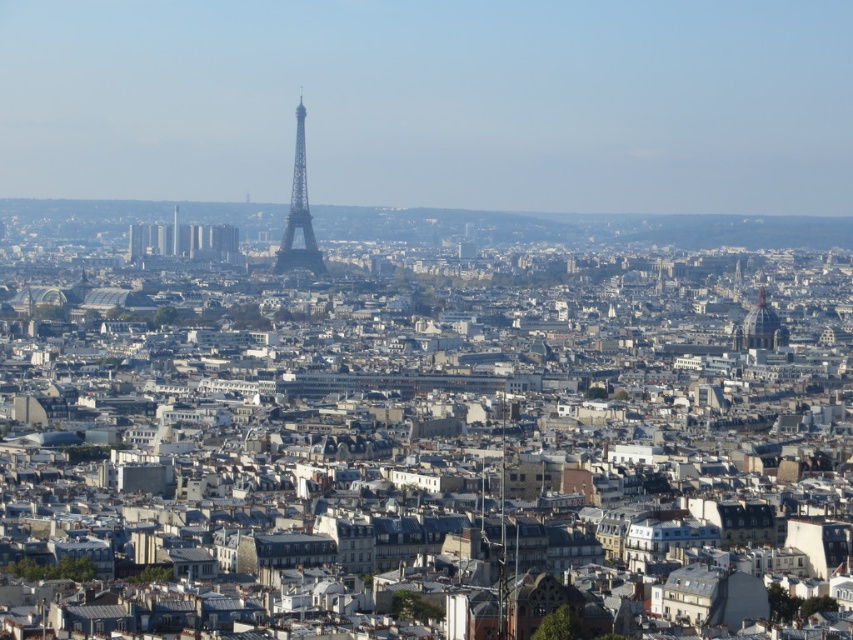
Looking at this image, you are standing at the point with coordinates 0.2, 0.2 in the image. You want to walk towards the metallic silver eiffel tower at center. In which direction should you move?

Since the metallic silver eiffel tower at center is located at point (299, 212), and you are at (170, 128), you should move northeast to reach it.